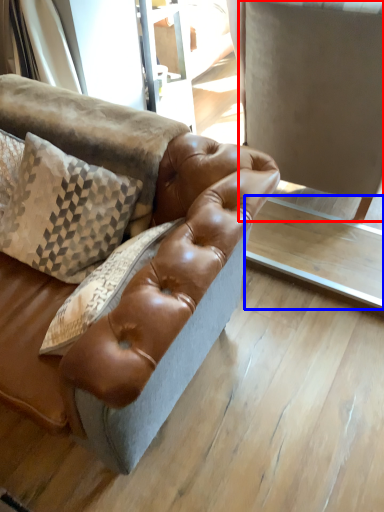
Question: Which object is closer to the camera taking this photo, swivel chair (highlighted by a red box) or table (highlighted by a blue box)?

Choices:
 (A) swivel chair
 (B) table

Answer: (A)